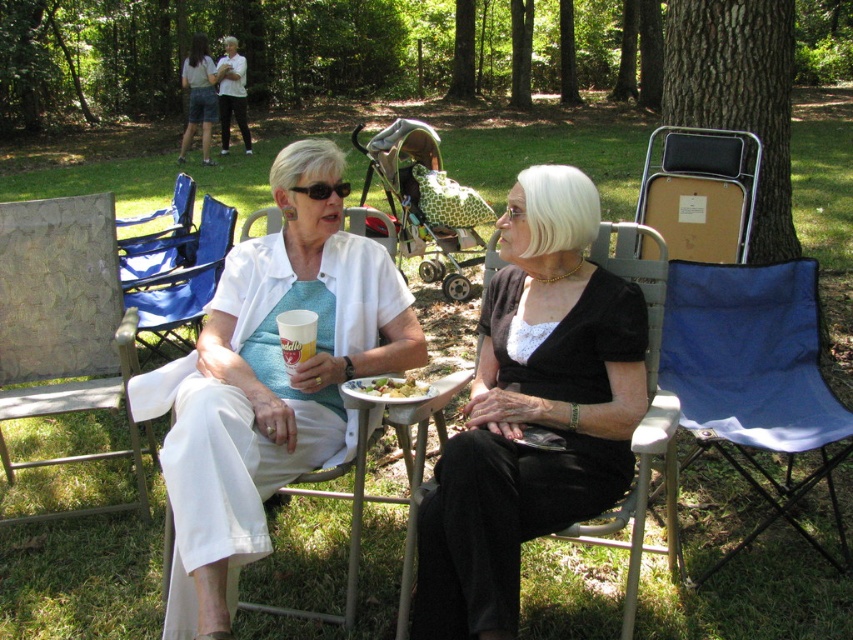
You are standing at the center of the image and want to move towards the textured fabric chair at left. Which direction should you move in?

You should move to the left since the textured fabric chair at left is located at the left side of the image.